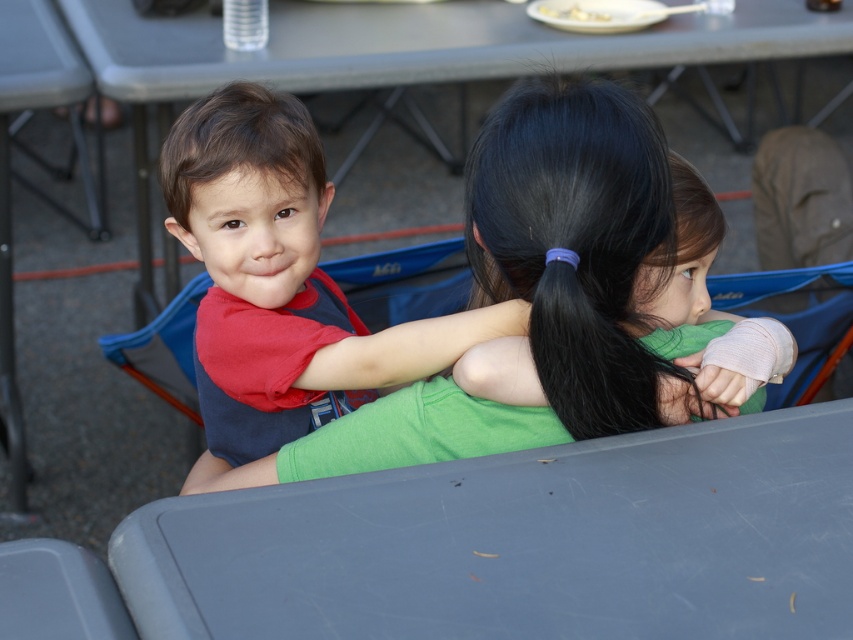
Can you confirm if gray plastic table at lower center is wider than brown matte hair at upper left?

Yes.

Is gray plastic table at lower center positioned in front of brown matte hair at upper left?

Yes, gray plastic table at lower center is in front of brown matte hair at upper left.

Does point (486, 460) come in front of point (306, 161)?

Yes, it is.

Locate an element on the screen. gray plastic table at lower center is located at coordinates (521, 544).

Which is more to the left, matte red shirt at upper left or brown matte hair at upper left?

brown matte hair at upper left

Can you confirm if matte red shirt at upper left is positioned above brown matte hair at upper left?

Actually, matte red shirt at upper left is below brown matte hair at upper left.

I want to click on matte red shirt at upper left, so click(x=550, y=292).

Is matte red shirt at upper left wider than black silky hair at upper center?

Indeed, matte red shirt at upper left has a greater width compared to black silky hair at upper center.

Does matte red shirt at upper left have a larger size compared to black silky hair at upper center?

Yes, matte red shirt at upper left is bigger than black silky hair at upper center.

The height and width of the screenshot is (640, 853). What are the coordinates of `matte red shirt at upper left` in the screenshot? It's located at (550, 292).